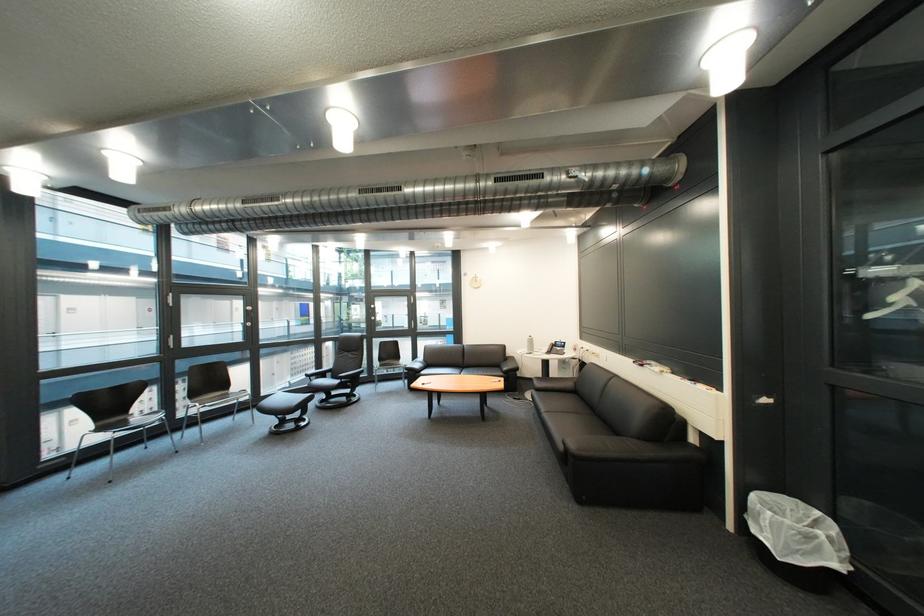
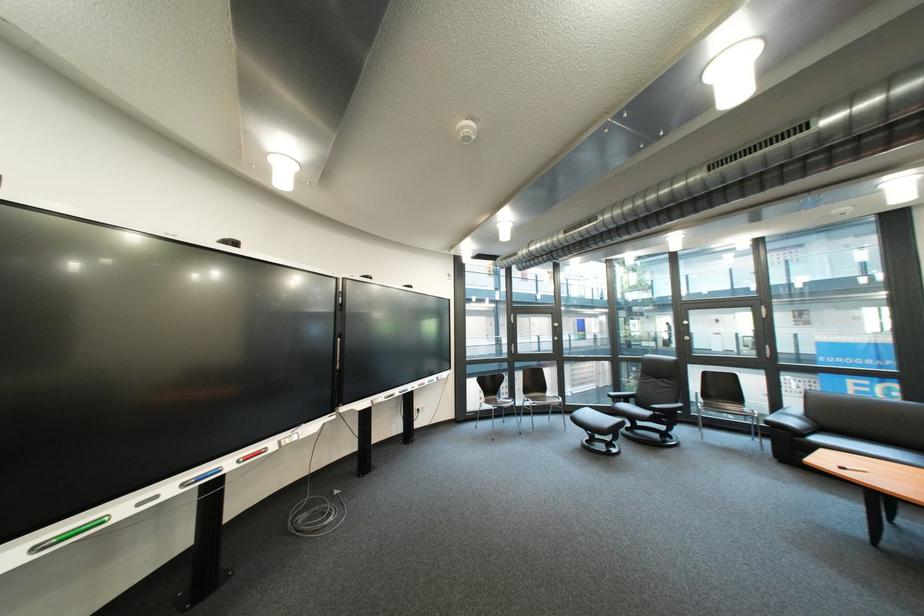
Find the pixel in the second image that matches [350,383] in the first image.

(661, 415)